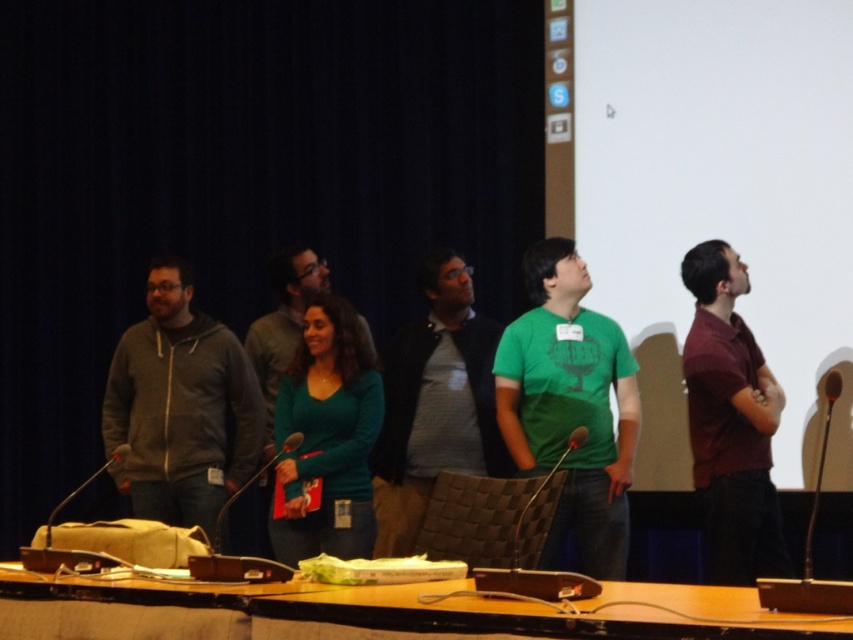
You are standing at the front of the stage and want to move to the point marked by point (585,346). However, there is an obstacle at point (346,394). Can you reach your destination without passing through the obstacle?

Point (585,346) is behind point (346,394), so you can reach point (585,346) without passing through the obstacle at point (346,394) because it is located behind it.

You are standing on the stage and want to hand a document to the person wearing the green matte shirt at center. Based on their position, where exactly should you walk to locate them?

The green matte shirt at center is located at point 0.634 on the x axis and 0.669 on the y axis, so you should walk to that coordinate to find them.